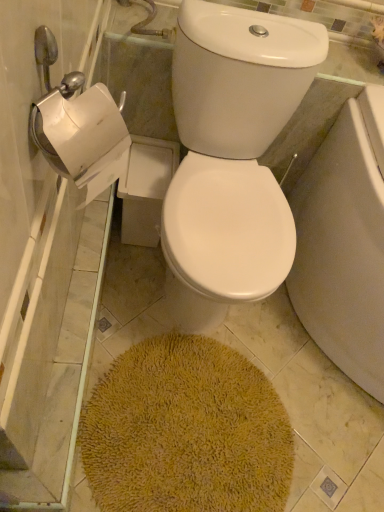
Question: Is yellow shaggy bath mat at center outside of white glossy toilet bowl at center?

Choices:
 (A) yes
 (B) no

Answer: (A)

Question: From a real-world perspective, is yellow shaggy bath mat at center under white glossy toilet bowl at center?

Choices:
 (A) no
 (B) yes

Answer: (B)

Question: Is yellow shaggy bath mat at center in front of white glossy toilet bowl at center?

Choices:
 (A) yes
 (B) no

Answer: (B)

Question: Is yellow shaggy bath mat at center to the right of white glossy toilet bowl at center from the viewer's perspective?

Choices:
 (A) yes
 (B) no

Answer: (B)

Question: From the image's perspective, is yellow shaggy bath mat at center beneath white glossy toilet bowl at center?

Choices:
 (A) yes
 (B) no

Answer: (A)

Question: From the image's perspective, is yellow shaggy bath mat at center above white glossy toilet bowl at center?

Choices:
 (A) yes
 (B) no

Answer: (B)

Question: Is white glossy toilet bowl at center positioned behind yellow shaggy bath mat at center?

Choices:
 (A) no
 (B) yes

Answer: (A)

Question: Can you confirm if white glossy toilet bowl at center is bigger than yellow shaggy bath mat at center?

Choices:
 (A) no
 (B) yes

Answer: (B)

Question: Is white glossy toilet bowl at center positioned with its back to yellow shaggy bath mat at center?

Choices:
 (A) yes
 (B) no

Answer: (B)

Question: Is white glossy toilet bowl at center at the right side of yellow shaggy bath mat at center?

Choices:
 (A) no
 (B) yes

Answer: (B)

Question: From a real-world perspective, does white glossy toilet bowl at center stand above yellow shaggy bath mat at center?

Choices:
 (A) yes
 (B) no

Answer: (A)

Question: Can you confirm if white glossy toilet bowl at center is taller than yellow shaggy bath mat at center?

Choices:
 (A) yes
 (B) no

Answer: (A)

Question: Considering the relative positions of white glossy toilet bowl at center and yellow shaggy bath mat at center in the image provided, is white glossy toilet bowl at center to the left or to the right of yellow shaggy bath mat at center?

Choices:
 (A) left
 (B) right

Answer: (B)